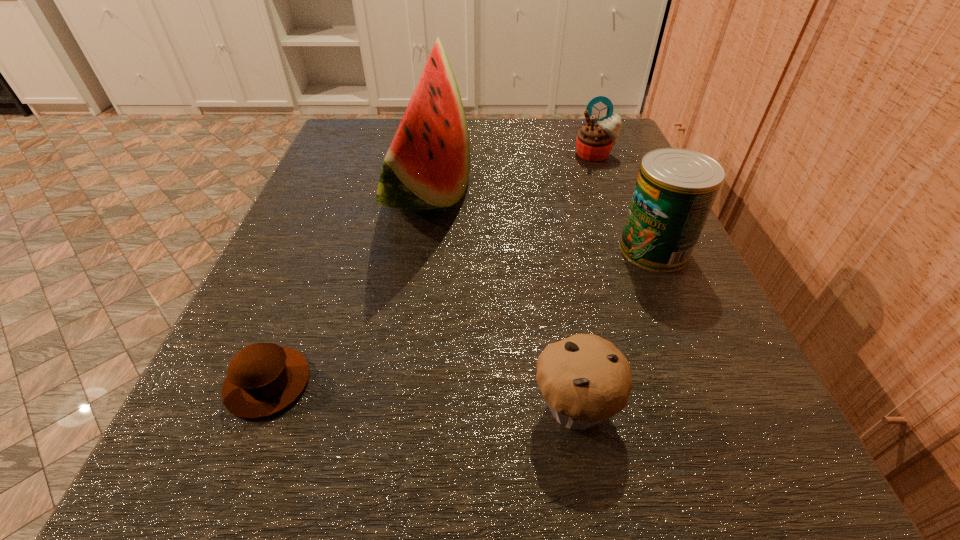
The width and height of the screenshot is (960, 540). I want to click on vacant area located on the front of the can, so click(681, 310).

The image size is (960, 540). In order to click on free space located 0.320m on the front-facing side of the tallest muffin in this screenshot , I will do `click(643, 282)`.

Where is `vacant area situated on the back of the second muffin from left to right`? vacant area situated on the back of the second muffin from left to right is located at coordinates point(545,234).

The width and height of the screenshot is (960, 540). Identify the location of vacant space located 0.340m on the back of the shortest object. (345, 191).

In order to click on watermelon that is positioned at the far edge in this screenshot , I will do `click(427, 166)`.

The image size is (960, 540). Find the location of `muffin present at the far edge`. muffin present at the far edge is located at coordinates (594, 142).

This screenshot has height=540, width=960. I want to click on object situated at the near edge, so click(585, 379).

The height and width of the screenshot is (540, 960). I want to click on watermelon located at the left edge, so click(x=427, y=166).

In order to click on muffin that is positioned at the left edge in this screenshot , I will do `click(263, 379)`.

Image resolution: width=960 pixels, height=540 pixels. What are the coordinates of `can that is at the right edge` in the screenshot? It's located at (675, 190).